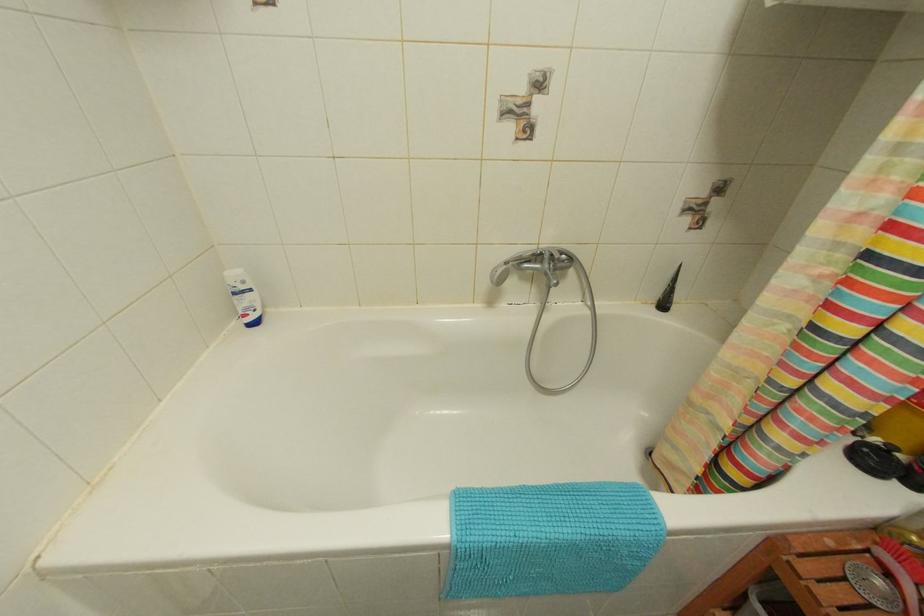
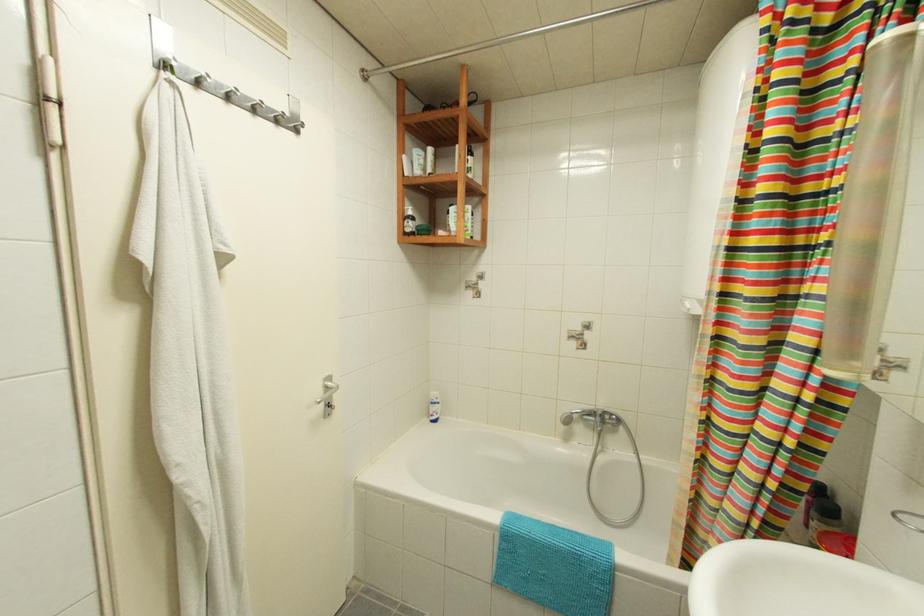
The first image is from the beginning of the video and the second image is from the end. How did the camera likely rotate when shooting the video?

The camera's rotation is toward left-up.